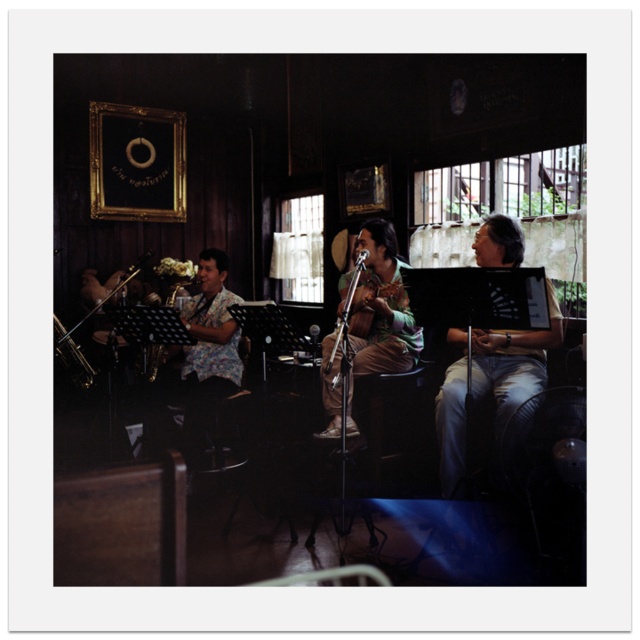
Can you confirm if floral fabric guitar at center is positioned below satin saxophone at center?

Indeed, floral fabric guitar at center is positioned under satin saxophone at center.

Measure the distance from floral fabric guitar at center to satin saxophone at center.

A distance of 5.56 feet exists between floral fabric guitar at center and satin saxophone at center.

You are a GUI agent. You are given a task and a screenshot of the screen. Output one action in this format:
    pyautogui.click(x=<x>, y=<y>)
    Task: Click on the floral fabric guitar at center
    
    Given the screenshot: What is the action you would take?
    pyautogui.click(x=380, y=312)

Does satin saxophone at center have a greater width compared to shiny brass saxophone at left?

Yes.

Who is shorter, satin saxophone at center or shiny brass saxophone at left?

satin saxophone at center is shorter.

What do you see at coordinates (177, 288) in the screenshot? I see `satin saxophone at center` at bounding box center [177, 288].

What are the coordinates of `satin saxophone at center` in the screenshot? It's located at (177, 288).

Which is more to the left, floral fabric guitar at center or floral shirt at center?

floral shirt at center is more to the left.

Who is lower down, floral fabric guitar at center or floral shirt at center?

Positioned lower is floral shirt at center.

You are a GUI agent. You are given a task and a screenshot of the screen. Output one action in this format:
    pyautogui.click(x=<x>, y=<y>)
    Task: Click on the floral fabric guitar at center
    Image resolution: width=640 pixels, height=640 pixels.
    Given the screenshot: What is the action you would take?
    pyautogui.click(x=380, y=312)